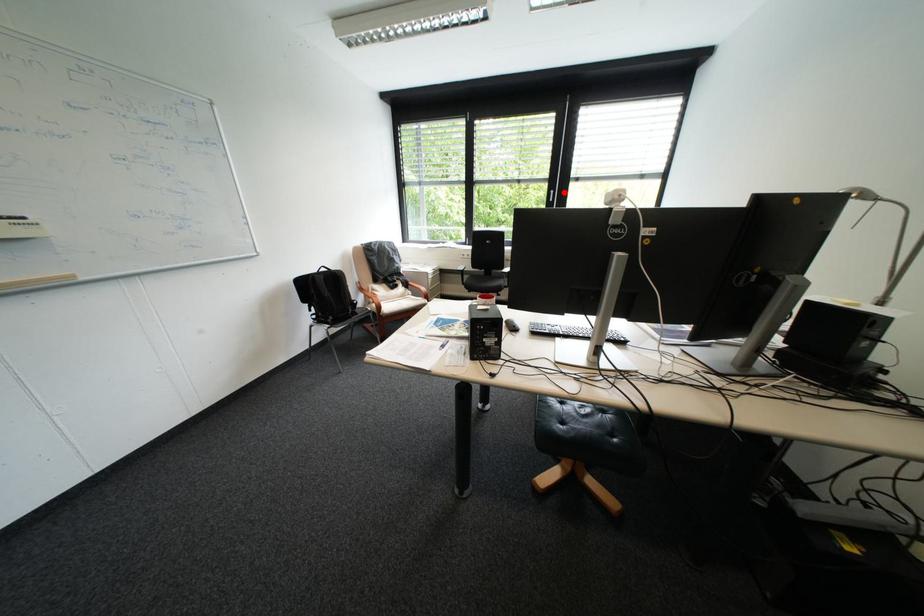
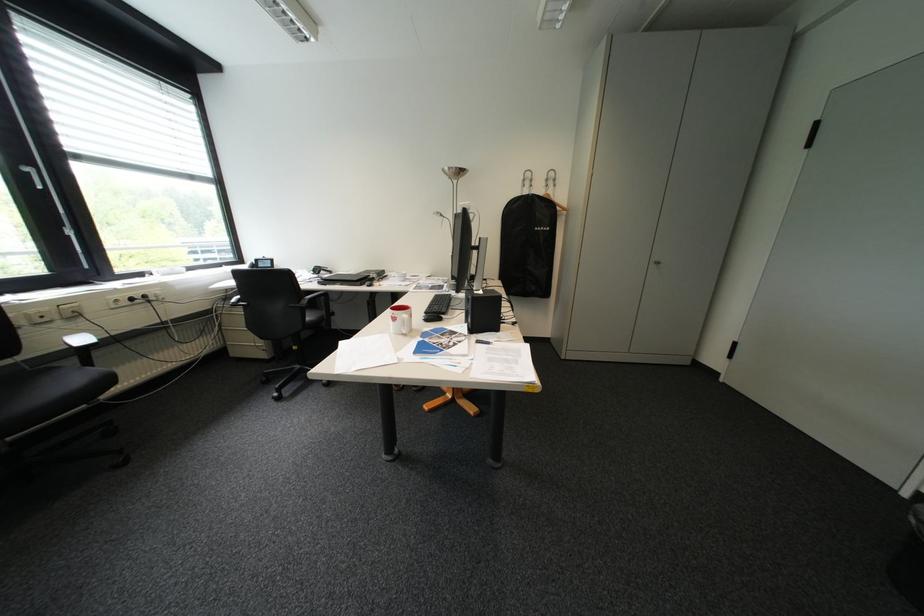
Question: I am providing you with two images of the same scene from different viewpoints. A red point is shown in image1. For the corresponding object point in image2, is it positioned nearer or farther from the camera?

Choices:
 (A) Nearer
 (B) Farther

Answer: (B)